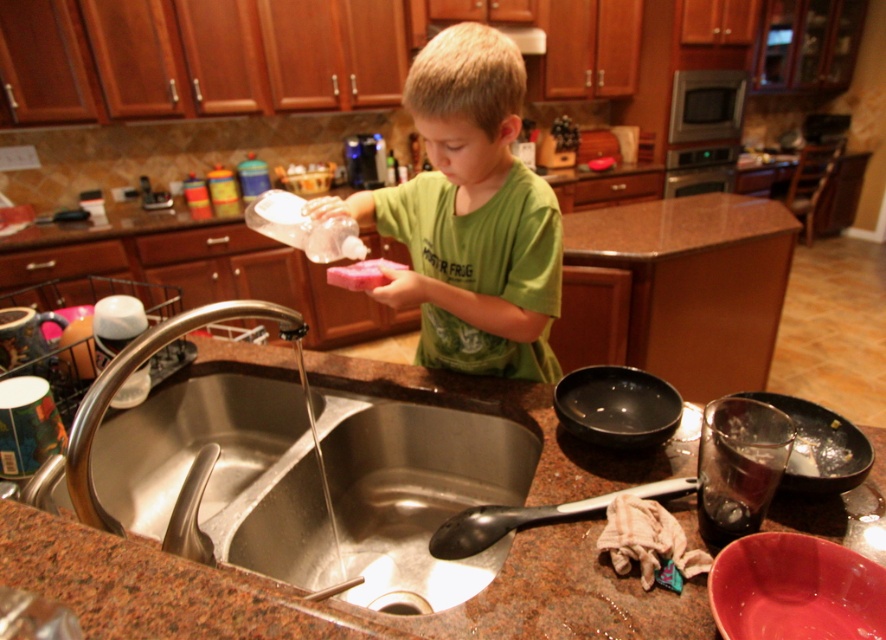
You are standing in the kitchen and need to place a new dish rack. The dish rack requires a space of 0.5 units in width. Can the area next to the stainless steel sink at lower left accommodate it based on its position?

The stainless steel sink at lower left is located at point (417,488). Since the dish rack requires 0.5 units in width, and the sink is positioned at this coordinate, it is possible to place the dish rack next to it if there is sufficient space. However, without additional spatial information about the surrounding area, it is difficult to confirm definitively.

You are a parent observing your child in the kitchen. Your child is holding the pink sponge at center near the stainless steel sink at lower left. If you want to place a small bowl between them, where should you put it?

The stainless steel sink at lower left is taller than the pink sponge at center, so you should place the small bowl between the stainless steel sink at lower left and the pink sponge at center at the lower part near the sponge since the sink is taller.

You are a parent observing your child in the kitchen. You notice the green matte shirt at center and the brushed metal faucet at sink left. Which object is taller?

The green matte shirt at center is taller than the brushed metal faucet at sink left.